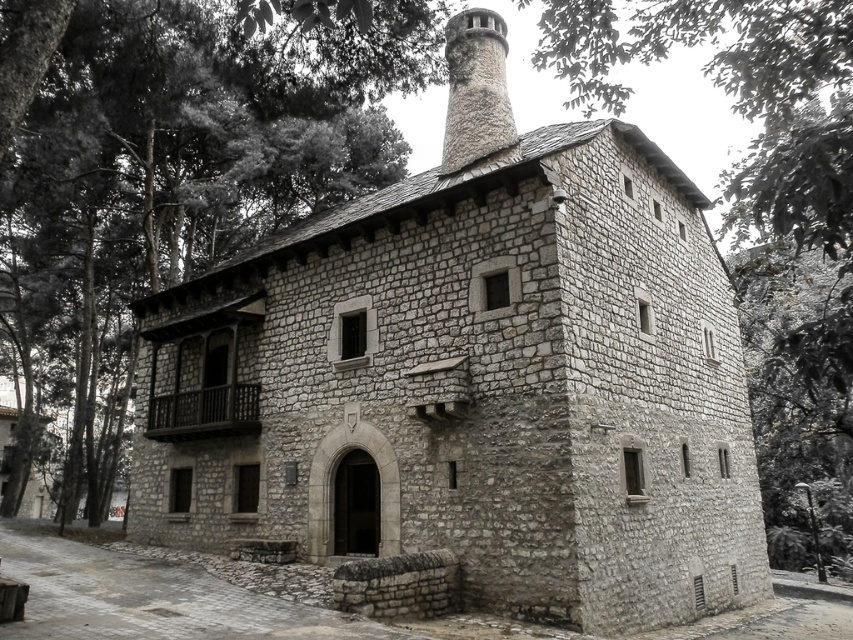
You are standing in front of the rustic stone building and notice two points marked on the structure. The first point is at coordinates point (383,182) and the second is at point (500,120). Which point is closer to you?

Point (383,182) is further to the camera than point (500,120), so the second point at (500,120) is closer to you.

You are standing in front of the rustic stone building and want to take a photo of the green leafy tree at upper left. If your camera has a maximum focus range of 7 meters, will you need to move closer to capture the tree clearly?

The green leafy tree at upper left is 7.59 meters away from the viewer. Since the camera can only focus up to 7 meters, you need to move closer to ensure the tree is in focus.